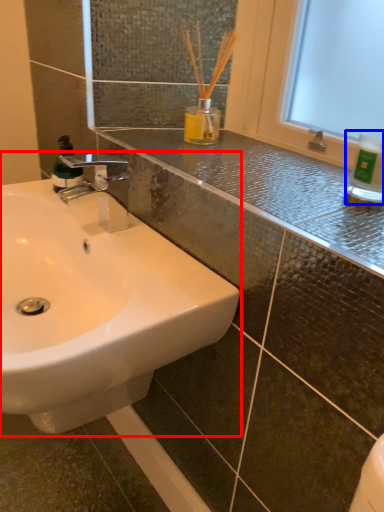
Question: Which object appears farthest to the camera in this image, sink (highlighted by a red box) or bottle (highlighted by a blue box)?

Choices:
 (A) sink
 (B) bottle

Answer: (B)